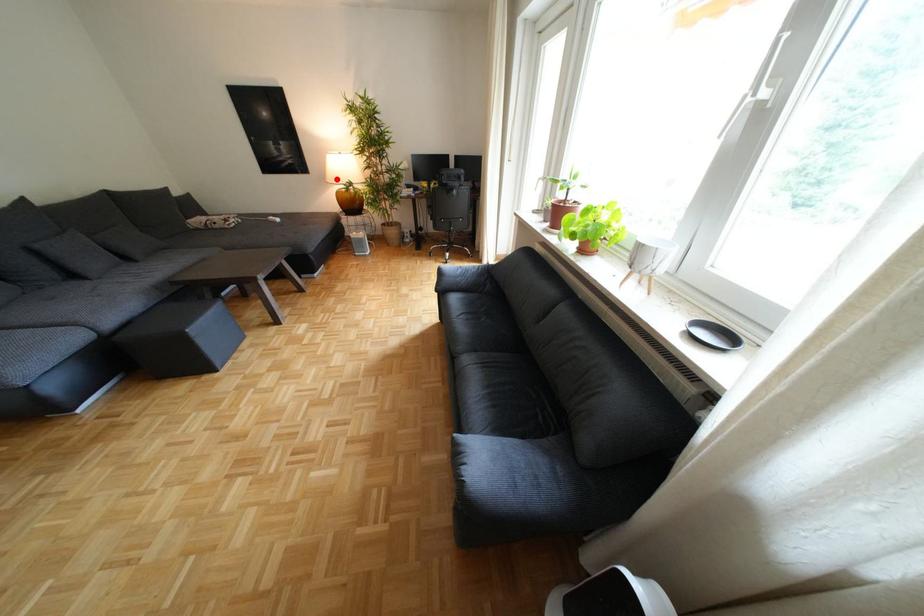
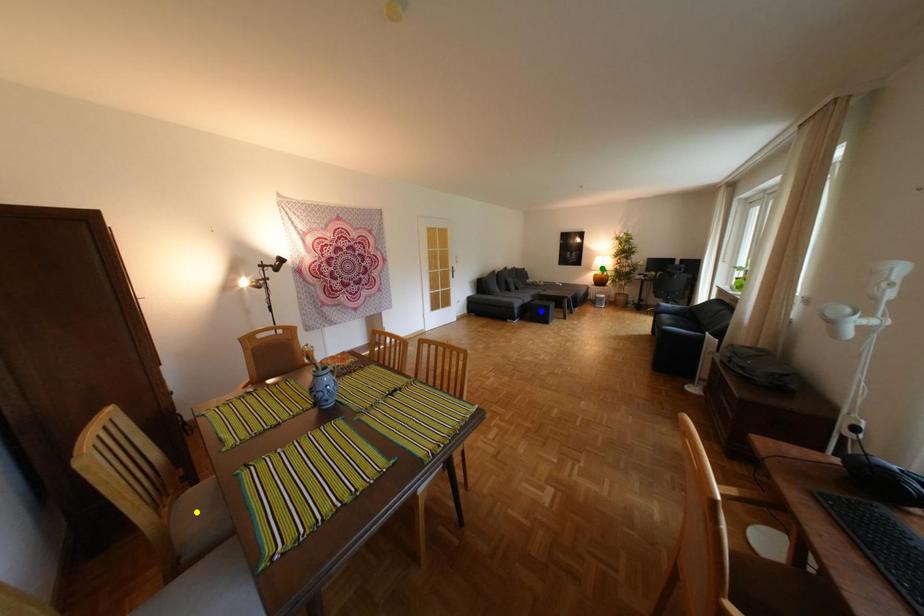
Question: I am providing you with two images of the same scene from different viewpoints. A red point is marked on the first image. You are given multiple points on the second image. Which spot in image 2 lines up with the point in image 1?

Choices:
 (A) yellow point
 (B) blue point
 (C) green point

Answer: (C)